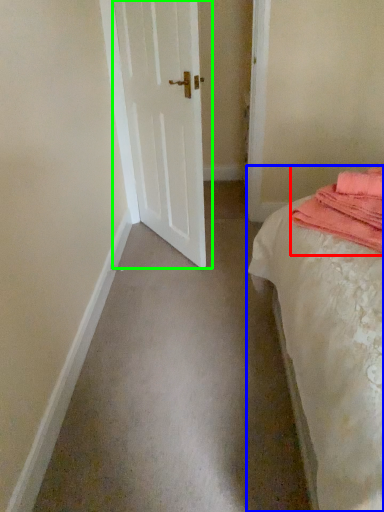
Question: Estimate the real-world distances between objects in this image. Which object is farther from material (highlighted by a red box), bed (highlighted by a blue box) or door (highlighted by a green box)?

Choices:
 (A) bed
 (B) door

Answer: (B)